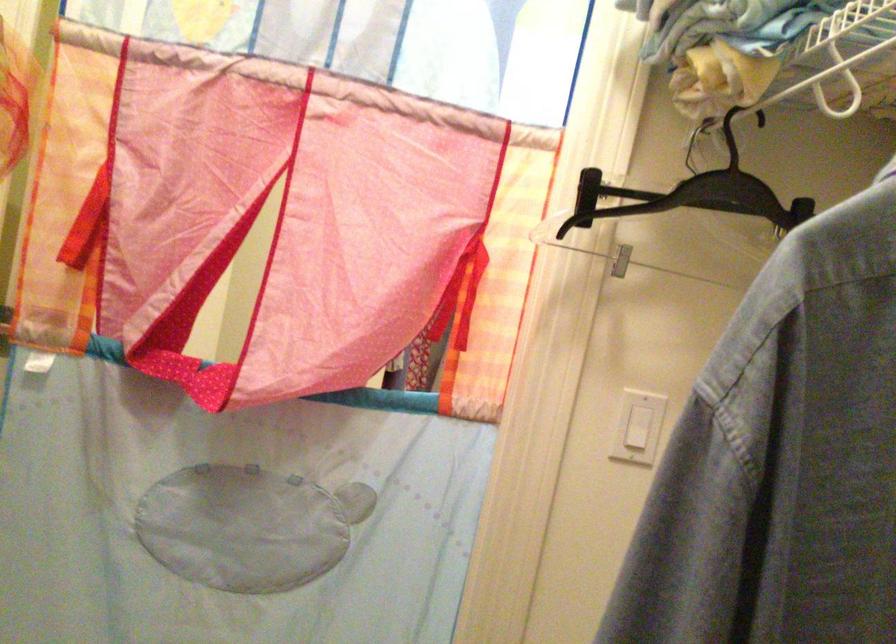
The width and height of the screenshot is (896, 644). Describe the element at coordinates (693, 194) in the screenshot. I see `the black clothes hanger` at that location.